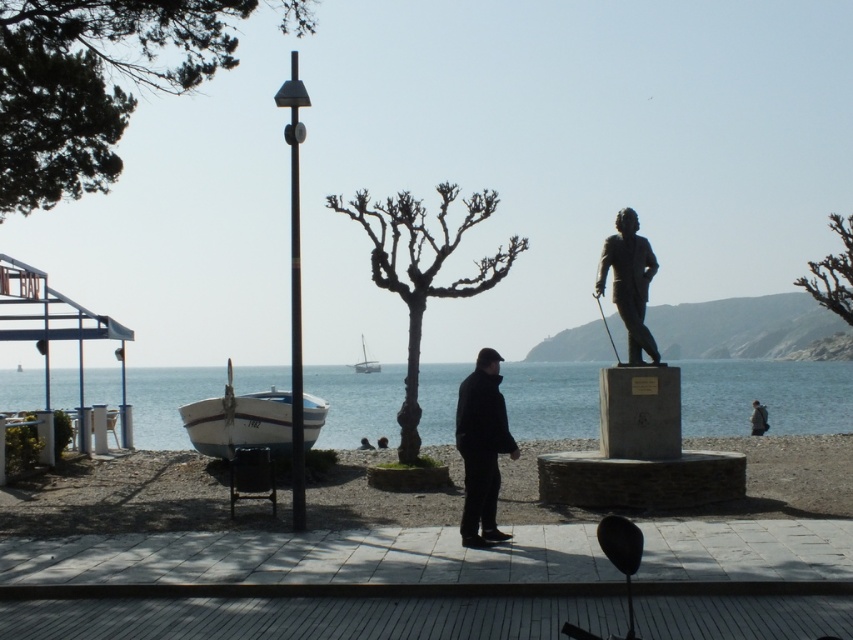
Which is more to the left, black matte jacket at center or white plastic boat at center?

From the viewer's perspective, white plastic boat at center appears more on the left side.

Who is higher up, black matte jacket at center or white plastic boat at center?

black matte jacket at center is above.

Identify the location of black matte jacket at center. This screenshot has width=853, height=640. (x=480, y=449).

You are a GUI agent. You are given a task and a screenshot of the screen. Output one action in this format:
    pyautogui.click(x=<x>, y=<y>)
    Task: Click on the black matte jacket at center
    
    Given the screenshot: What is the action you would take?
    pyautogui.click(x=480, y=449)

Which of these two, matte black pole at center or white plastic boat at center, stands taller?

With more height is matte black pole at center.

Looking at this image, is matte black pole at center smaller than white plastic boat at center?

Actually, matte black pole at center might be larger than white plastic boat at center.

Between point (289, 184) and point (372, 358), which one is positioned in front?

Point (289, 184)

Where is `matte black pole at center`? The image size is (853, 640). matte black pole at center is located at coordinates (294, 288).

Who is lower down, brown fur coat at center or white plastic boat at center?

Positioned lower is brown fur coat at center.

The height and width of the screenshot is (640, 853). What are the coordinates of `brown fur coat at center` in the screenshot? It's located at (758, 419).

You are a GUI agent. You are given a task and a screenshot of the screen. Output one action in this format:
    pyautogui.click(x=<x>, y=<y>)
    Task: Click on the brown fur coat at center
    This screenshot has height=640, width=853.
    Given the screenshot: What is the action you would take?
    pyautogui.click(x=758, y=419)